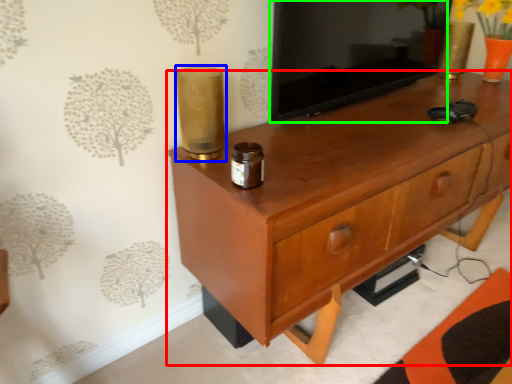
Question: Which object is the farthest from chest of drawers (highlighted by a red box)? Choose among these: candle holder (highlighted by a blue box) or tv cabinet (highlighted by a green box).

Choices:
 (A) candle holder
 (B) tv cabinet

Answer: (A)